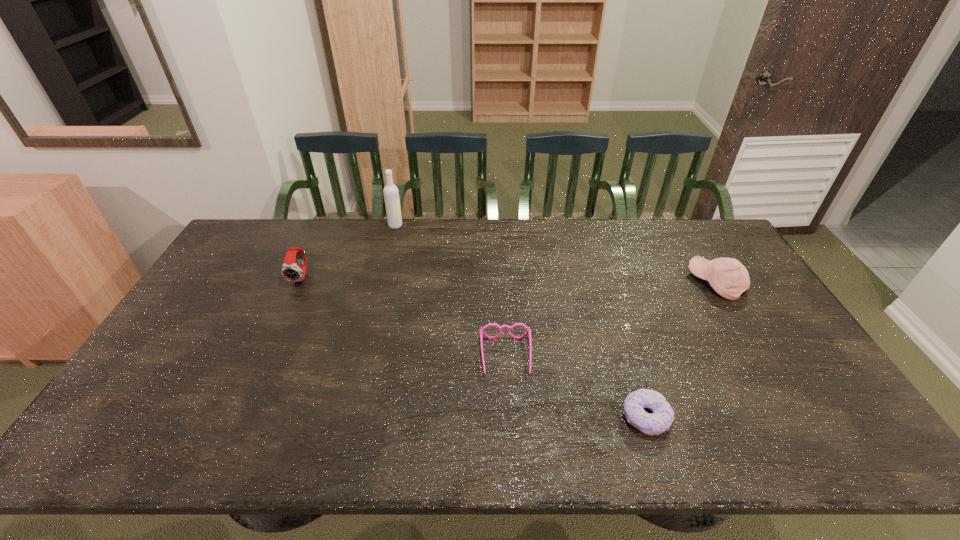
Locate an element on the screen. The width and height of the screenshot is (960, 540). the farthest object is located at coordinates (391, 194).

Locate an element on the screen. vodka is located at coordinates (391, 194).

Find the location of a particular element. This screenshot has width=960, height=540. the leftmost object is located at coordinates (290, 271).

Image resolution: width=960 pixels, height=540 pixels. In order to click on the rightmost object in this screenshot , I will do `click(728, 277)`.

At what (x,y) coordinates should I click in order to perform the action: click on the third object from right to left. Please return your answer as a coordinate pair (x, y). The height and width of the screenshot is (540, 960). Looking at the image, I should click on (528, 332).

Identify the location of spectacles. (528, 332).

Locate an element on the screen. This screenshot has height=540, width=960. the nearest object is located at coordinates (663, 415).

This screenshot has height=540, width=960. Find the location of `doughnut`. doughnut is located at coordinates (663, 415).

This screenshot has width=960, height=540. In order to click on free space located on the right of the vodka in this screenshot , I will do `click(503, 225)`.

This screenshot has height=540, width=960. Find the location of `free spot located on the face of the watch`. free spot located on the face of the watch is located at coordinates (270, 345).